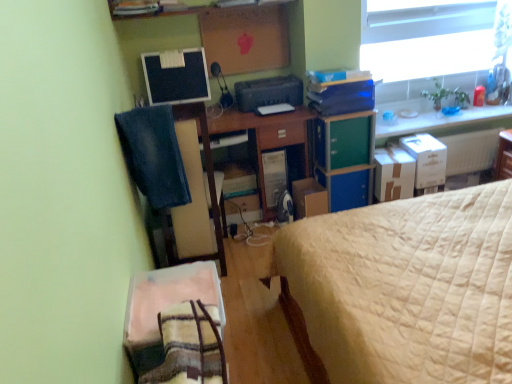
Question: Does satin black computer tower at center have a larger size compared to cardboard box at center, positioned as the 1th cardboard box in left-to-right order?

Choices:
 (A) yes
 (B) no

Answer: (A)

Question: Is satin black computer tower at center behind cardboard box at center, the 3th cardboard box viewed from the right?

Choices:
 (A) yes
 (B) no

Answer: (A)

Question: Is satin black computer tower at center placed right next to cardboard box at center, positioned as the 1th cardboard box in left-to-right order?

Choices:
 (A) yes
 (B) no

Answer: (B)

Question: Is the depth of satin black computer tower at center less than that of cardboard box at center, positioned as the 1th cardboard box in left-to-right order?

Choices:
 (A) yes
 (B) no

Answer: (B)

Question: Would you say satin black computer tower at center is a long distance from cardboard box at center, positioned as the 1th cardboard box in left-to-right order?

Choices:
 (A) no
 (B) yes

Answer: (A)

Question: From a real-world perspective, relative to beige quilted bed at right, is wooden desk at center vertically above or below?

Choices:
 (A) below
 (B) above

Answer: (A)

Question: Would you say wooden desk at center is to the left or to the right of beige quilted bed at right in the picture?

Choices:
 (A) right
 (B) left

Answer: (B)

Question: From the image's perspective, is wooden desk at center above or below beige quilted bed at right?

Choices:
 (A) below
 (B) above

Answer: (B)

Question: Is point (287, 124) closer or farther from the camera than point (395, 206)?

Choices:
 (A) closer
 (B) farther

Answer: (B)

Question: In terms of width, does matte black monitor at upper center look wider or thinner when compared to white cardboard box at upper right, the first cardboard box viewed from the right?

Choices:
 (A) wide
 (B) thin

Answer: (B)

Question: Considering the positions of matte black monitor at upper center and white cardboard box at upper right, the first cardboard box viewed from the right, in the image, is matte black monitor at upper center bigger or smaller than white cardboard box at upper right, the first cardboard box viewed from the right,?

Choices:
 (A) small
 (B) big

Answer: (B)

Question: In the image, is matte black monitor at upper center on the left side or the right side of white cardboard box at upper right, the first cardboard box viewed from the right?

Choices:
 (A) right
 (B) left

Answer: (B)

Question: Is point (168, 84) positioned closer to the camera than point (426, 152)?

Choices:
 (A) farther
 (B) closer

Answer: (A)

Question: In terms of size, does transparent glass window at upper right appear bigger or smaller than brown cardboard box at right, the second cardboard box viewed from the left?

Choices:
 (A) small
 (B) big

Answer: (B)

Question: From the image's perspective, is transparent glass window at upper right positioned above or below brown cardboard box at right, which is counted as the 2th cardboard box, starting from the right?

Choices:
 (A) above
 (B) below

Answer: (A)